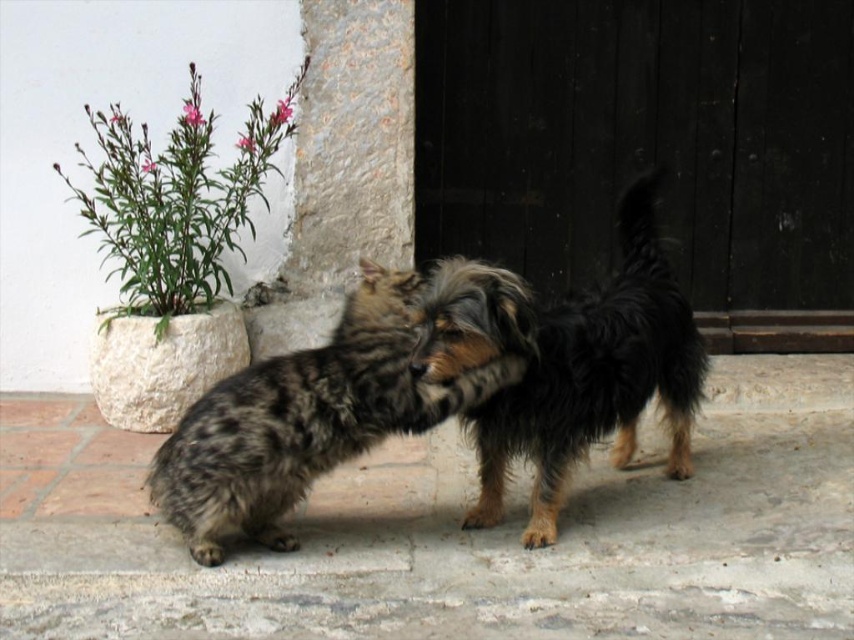
You are a photographer trying to capture a closeup of the shaggy brown dog at center without the green leafy plant at upper left appearing in the frame. Based on their sizes, can you determine if the dog is large enough to block the view of the plant?

The shaggy brown dog at center is larger in size than the green leafy plant at upper left, so it can potentially block the view of the plant if positioned correctly.

You are a photographer trying to capture a photo of both the shaggy brown dog at center and the fluffy brown dog at center. Since you want to ensure both are fully visible in the frame, which dog should you position closer to the camera to avoid cropping?

You should position the shaggy brown dog at center closer to the camera because it is taller than the fluffy brown dog at center, ensuring both are fully visible without cropping.